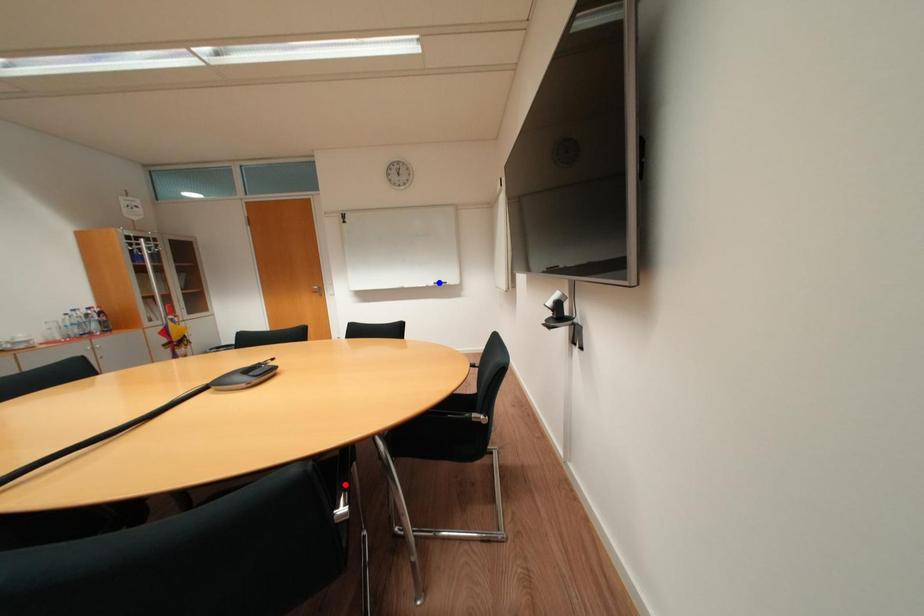
Question: Two points are marked on the image. Which point is closer to the camera?

Choices:
 (A) Blue point is closer.
 (B) Red point is closer.

Answer: (B)